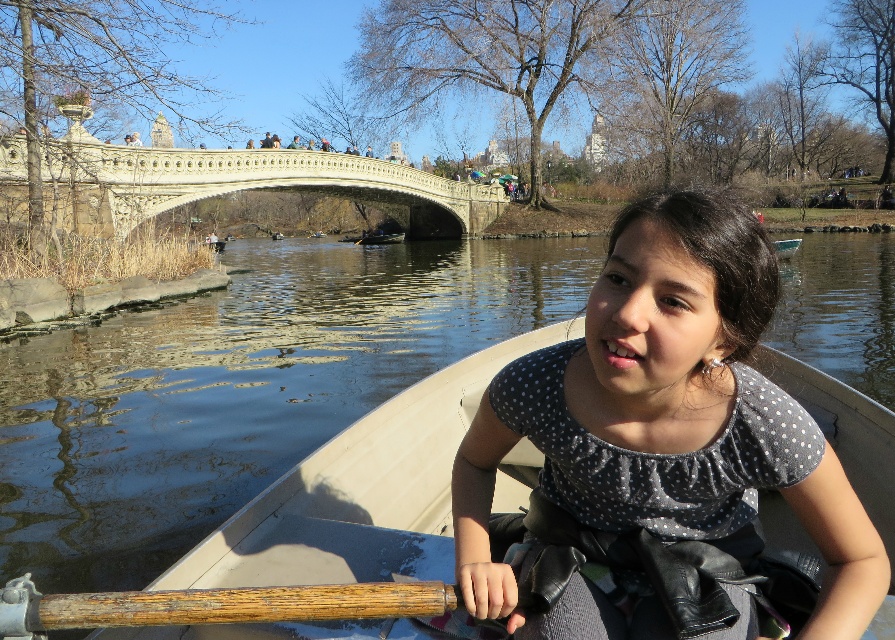
Question: Which of the following is the closest to the observer?

Choices:
 (A) white stone bridge at upper center
 (B) wooden textured paddle at lower left
 (C) polka dot fabric shirt at center
 (D) clear water at boat center

Answer: (B)

Question: Is the position of clear water at boat center more distant than that of polka dot fabric shirt at center?

Choices:
 (A) yes
 (B) no

Answer: (A)

Question: Which object is positioned farthest from the polka dot fabric shirt at center?

Choices:
 (A) wooden textured paddle at lower left
 (B) white stone bridge at upper center

Answer: (B)

Question: Can you confirm if clear water at boat center is positioned to the left of wooden textured paddle at lower left?

Choices:
 (A) yes
 (B) no

Answer: (A)

Question: Can you confirm if clear water at boat center is thinner than polka dot fabric shirt at center?

Choices:
 (A) yes
 (B) no

Answer: (B)

Question: Among these points, which one is nearest to the camera?

Choices:
 (A) (454, 296)
 (B) (145, 202)
 (C) (831, 483)
 (D) (139, 595)

Answer: (D)